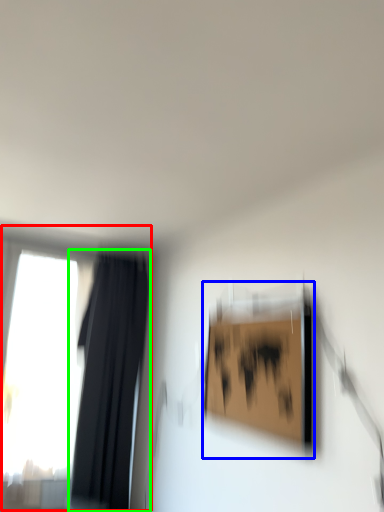
Question: Which object is the farthest from window (highlighted by a red box)? Choose among these: picture frame (highlighted by a blue box) or curtain (highlighted by a green box).

Choices:
 (A) picture frame
 (B) curtain

Answer: (A)